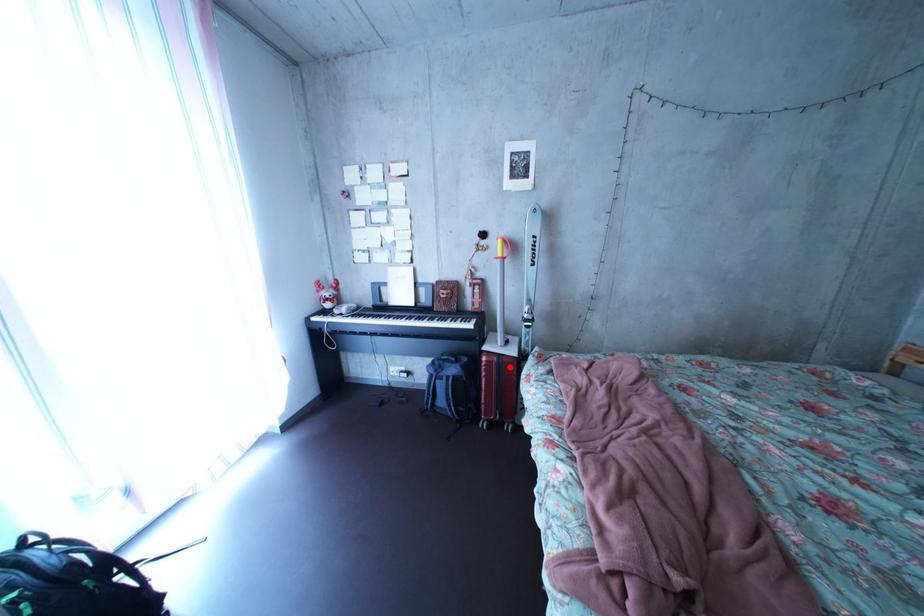
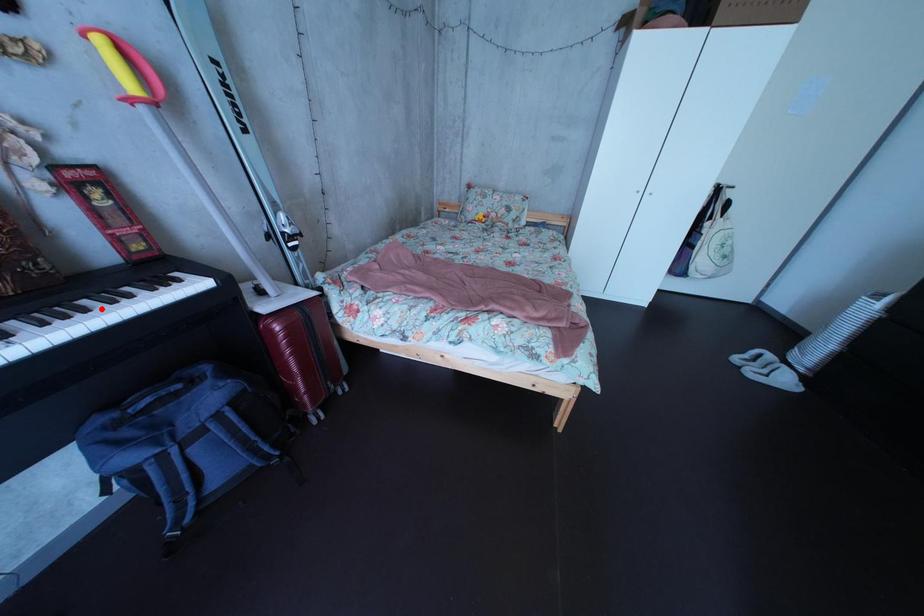
I am providing you with two images of the same scene from different viewpoints. A red point is marked on the first image and another point is marked on the second image. Do the highlighted points in image1 and image2 indicate the same real-world spot?

No